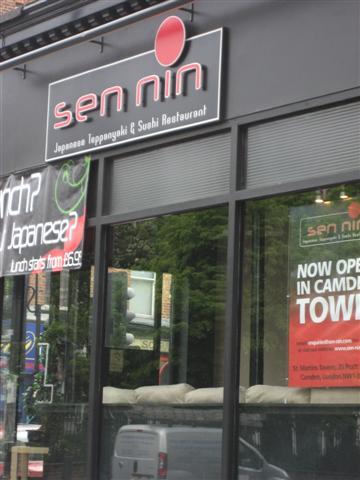
I want to click on window, so [142, 298].